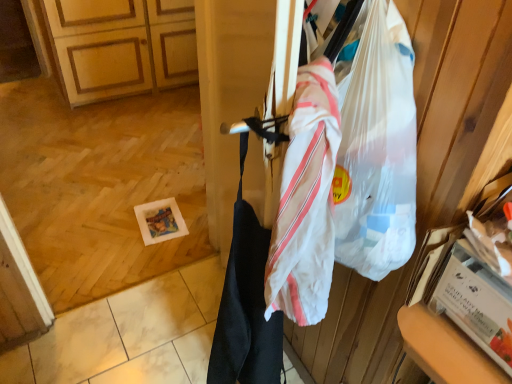
Describe the element at coordinates (459, 102) in the screenshot. I see `white plastic bag at upper right` at that location.

You are a GUI agent. You are given a task and a screenshot of the screen. Output one action in this format:
    pyautogui.click(x=<x>, y=<y>)
    Task: Click on the white plastic bag at upper right
    This screenshot has height=384, width=512.
    Given the screenshot: What is the action you would take?
    pyautogui.click(x=459, y=102)

What are the coordinates of `white plastic bag at upper right` in the screenshot? It's located at (459, 102).